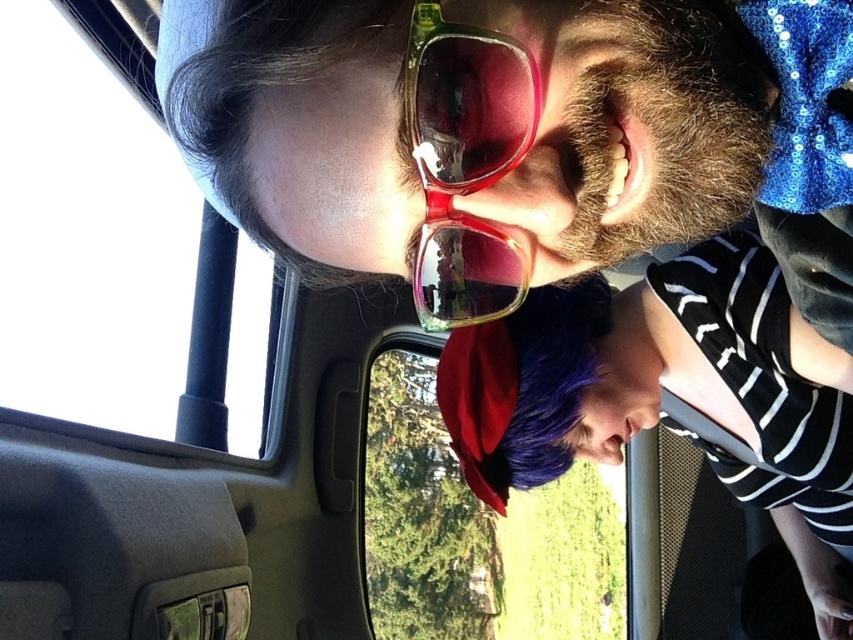
You are sitting in the passenger seat of a car and want to hand a small note to the person wearing the purple fabric cap at lower center. The transparent plastic car window at lower center is between you and the cap. Can you reach the cap without opening the window?

The purple fabric cap at lower center is closer to the viewer than the transparent plastic car window at lower center, so you can reach the cap without opening the window since it is in front of the window.

Looking at this image, you are a passenger in a car and want to check the weather outside. You have the option to look through the transparent glass car window at upper left or the purple fabric cap at lower center. Which object would allow you to see the weather outside more clearly?

The transparent glass car window at upper left allows you to see the weather outside more clearly because it is made of transparent material, unlike the purple fabric cap at lower center which is opaque.

You are a passenger in a car and want to know which object is taller between the purple fabric cap at lower center and the translucent plastic goggles at center. Can you tell me?

The purple fabric cap at lower center is taller than the translucent plastic goggles at center.